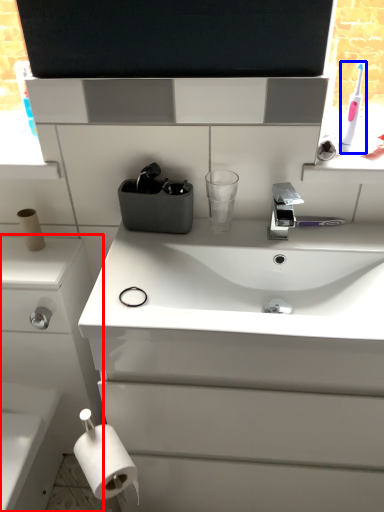
Question: Which object is further to the camera taking this photo, bathroom cabinet (highlighted by a red box) or toothbrush (highlighted by a blue box)?

Choices:
 (A) bathroom cabinet
 (B) toothbrush

Answer: (B)